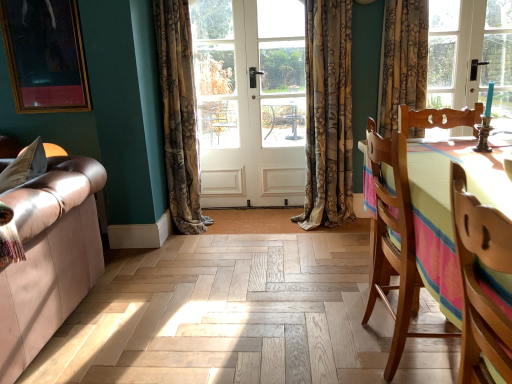
Find the location of a particular element. This screenshot has width=512, height=384. white wood door at center is located at coordinates (250, 100).

What do you see at coordinates (45, 55) in the screenshot?
I see `gold-framed portrait at upper left` at bounding box center [45, 55].

Locate an element on the screen. floral fabric curtain at center, the 1th curtain from the right is located at coordinates (328, 115).

I want to click on floral fabric curtain at center, the 1th curtain in the left-to-right sequence, so click(179, 114).

This screenshot has height=384, width=512. Identify the location of suede leather couch at left. click(x=49, y=257).

What are the coordinates of `white wood door at center` in the screenshot? It's located at (250, 100).

Is white wooden screen door at center facing away from floral fabric curtain at center, acting as the second curtain starting from the left?

No, floral fabric curtain at center, acting as the second curtain starting from the left, is not at the back of white wooden screen door at center.

Is white wooden screen door at center positioned far away from floral fabric curtain at center, acting as the second curtain starting from the left?

No, white wooden screen door at center is in close proximity to floral fabric curtain at center, acting as the second curtain starting from the left.

From a real-world perspective, which is physically below, white wooden screen door at center or floral fabric curtain at center, the 1th curtain from the right?

floral fabric curtain at center, the 1th curtain from the right, is physically lower.

Consider the image. What's the angular difference between white wooden screen door at center and floral fabric curtain at center, acting as the second curtain starting from the left,'s facing directions?

white wooden screen door at center and floral fabric curtain at center, acting as the second curtain starting from the left, are facing 0.115 degrees away from each other.

Which of these two, wooden chair at right, placed as the first chair when sorted from front to back, or gold-framed portrait at upper left, is smaller?

gold-framed portrait at upper left is smaller.

Considering the positions of objects wooden chair at right, the second chair viewed from the back, and gold-framed portrait at upper left in the image provided, who is more to the right, wooden chair at right, the second chair viewed from the back, or gold-framed portrait at upper left?

wooden chair at right, the second chair viewed from the back, is more to the right.

Where is `picture frame above the wooden chair at right, placed as the first chair when sorted from front to back (from the image's perspective)`? The height and width of the screenshot is (384, 512). picture frame above the wooden chair at right, placed as the first chair when sorted from front to back (from the image's perspective) is located at coordinates (45, 55).

Who is shorter, wooden chair at right, placed as the first chair when sorted from front to back, or gold-framed portrait at upper left?

wooden chair at right, placed as the first chair when sorted from front to back.

From the image's perspective, is gold-framed portrait at upper left on white wood door at center?

Indeed, from the image's perspective, gold-framed portrait at upper left is shown above white wood door at center.

Can you tell me how much gold-framed portrait at upper left and white wood door at center differ in facing direction?

gold-framed portrait at upper left and white wood door at center are facing 0.553 degrees away from each other.

The height and width of the screenshot is (384, 512). Identify the location of picture frame lying above the white wood door at center (from the image's perspective). (45, 55).

Is the surface of gold-framed portrait at upper left in direct contact with white wood door at center?

They are not placed beside each other.

Is wooden chair at right, the first chair positioned from the back, surrounding floral fabric curtain at center, acting as the second curtain starting from the left?

No, wooden chair at right, the first chair positioned from the back, does not contain floral fabric curtain at center, acting as the second curtain starting from the left.

From the image's perspective, which is above, wooden chair at right, the first chair positioned from the back, or floral fabric curtain at center, acting as the second curtain starting from the left?

floral fabric curtain at center, acting as the second curtain starting from the left, appears higher in the image.

Which is more to the left, wooden chair at right, which is counted as the second chair, starting from the front, or floral fabric curtain at center, acting as the second curtain starting from the left?

Positioned to the left is floral fabric curtain at center, acting as the second curtain starting from the left.

From a real-world perspective, relative to floral fabric curtain at center, the 1th curtain from the right, is wooden chair at right, the first chair positioned from the back, vertically above or below?

wooden chair at right, the first chair positioned from the back, is situated lower than floral fabric curtain at center, the 1th curtain from the right, in the real world.

Does suede leather couch at left have a greater width compared to wooden chair at right, which is counted as the second chair, starting from the front?

Correct, the width of suede leather couch at left exceeds that of wooden chair at right, which is counted as the second chair, starting from the front.

Is suede leather couch at left shorter than wooden chair at right, which is counted as the second chair, starting from the front?

Indeed, suede leather couch at left has a lesser height compared to wooden chair at right, which is counted as the second chair, starting from the front.

Does suede leather couch at left have a larger size compared to wooden chair at right, which is counted as the second chair, starting from the front?

Yes, suede leather couch at left is bigger than wooden chair at right, which is counted as the second chair, starting from the front.

Considering the points (99, 234) and (390, 137), which point is in front, point (99, 234) or point (390, 137)?

The point (390, 137) is in front.

Considering the positions of objects floral fabric curtain at center, the 1th curtain in the left-to-right sequence, and floral fabric curtain at center, the 1th curtain from the right, in the image provided, who is behind, floral fabric curtain at center, the 1th curtain in the left-to-right sequence, or floral fabric curtain at center, the 1th curtain from the right,?

floral fabric curtain at center, the 1th curtain from the right, is behind.

Is floral fabric curtain at center, the second curtain when ordered from right to left, oriented away from floral fabric curtain at center, the 1th curtain from the right?

No, floral fabric curtain at center, the second curtain when ordered from right to left, is not facing the opposite direction of floral fabric curtain at center, the 1th curtain from the right.

Considering the relative positions of floral fabric curtain at center, the second curtain when ordered from right to left, and floral fabric curtain at center, the 1th curtain from the right, in the image provided, is floral fabric curtain at center, the second curtain when ordered from right to left, to the right of floral fabric curtain at center, the 1th curtain from the right, from the viewer's perspective?

No.

From a real-world perspective, which object rests below the other?

From a 3D spatial view, floral fabric curtain at center, the 1th curtain from the right, is below.

Looking at this image, from the image's perspective, who appears lower, suede leather couch at left or floral fabric curtain at center, the second curtain when ordered from right to left?

suede leather couch at left appears lower in the image.

How many degrees apart are the facing directions of suede leather couch at left and floral fabric curtain at center, the 1th curtain in the left-to-right sequence?

87.1 degrees.

From a real-world perspective, is suede leather couch at left physically located above or below floral fabric curtain at center, the second curtain when ordered from right to left?

Clearly, from a real-world perspective, suede leather couch at left is below floral fabric curtain at center, the second curtain when ordered from right to left.

Identify the location of curtain that is the 1st object located below the white wooden screen door at center (from the image's perspective). (328, 115).

From the gold-framed portrait at upper left, count 2nd chairs forward and point to it. Please provide its 2D coordinates.

[(478, 284)]

When comparing their distances from white wooden screen door at center, does floral fabric curtain at center, the second curtain when ordered from right to left, or gold-framed portrait at upper left seem further?

The object further to white wooden screen door at center is gold-framed portrait at upper left.

Based on their spatial positions, is suede leather couch at left or wooden chair at right, the first chair positioned from the back, closer to gold-framed portrait at upper left?

The object closer to gold-framed portrait at upper left is suede leather couch at left.

Estimate the real-world distances between objects in this image. Which object is further from gold-framed portrait at upper left, floral fabric curtain at center, the 1th curtain in the left-to-right sequence, or white wooden screen door at center?

white wooden screen door at center is further to gold-framed portrait at upper left.

Considering their positions, is suede leather couch at left positioned further to gold-framed portrait at upper left than white wood door at center?

suede leather couch at left is positioned further to the anchor gold-framed portrait at upper left.

Looking at this image, considering their positions, is gold-framed portrait at upper left positioned closer to white wood door at center than floral fabric curtain at center, the 1th curtain from the right?

Among the two, floral fabric curtain at center, the 1th curtain from the right, is located nearer to white wood door at center.

When comparing their distances from floral fabric curtain at center, the 1th curtain from the right, does white wooden screen door at center or suede leather couch at left seem further?

suede leather couch at left is positioned further to the anchor floral fabric curtain at center, the 1th curtain from the right.

When comparing their distances from wooden chair at right, which is counted as the second chair, starting from the front, does gold-framed portrait at upper left or floral fabric curtain at center, the 1th curtain from the right, seem further?

gold-framed portrait at upper left is positioned further to the anchor wooden chair at right, which is counted as the second chair, starting from the front.

Looking at the image, which one is located further to floral fabric curtain at center, the 1th curtain in the left-to-right sequence, white wooden screen door at center or wooden chair at right, placed as the first chair when sorted from front to back?

wooden chair at right, placed as the first chair when sorted from front to back, is positioned further to the anchor floral fabric curtain at center, the 1th curtain in the left-to-right sequence.

I want to click on picture frame between wooden chair at right, placed as the first chair when sorted from front to back, and white wooden screen door at center, along the z-axis, so click(x=45, y=55).

At what (x,y) coordinates should I click in order to perform the action: click on studio couch located between wooden chair at right, placed as the first chair when sorted from front to back, and floral fabric curtain at center, the second curtain when ordered from right to left, in the depth direction. Please return your answer as a coordinate pair (x, y). The width and height of the screenshot is (512, 384). Looking at the image, I should click on (49, 257).

This screenshot has width=512, height=384. I want to click on studio couch positioned between wooden chair at right, the second chair viewed from the back, and white wooden screen door at center from near to far, so click(49, 257).

Where is `curtain between wooden chair at right, the first chair positioned from the back, and floral fabric curtain at center, the 1th curtain from the right, along the z-axis`? curtain between wooden chair at right, the first chair positioned from the back, and floral fabric curtain at center, the 1th curtain from the right, along the z-axis is located at coordinates (179, 114).